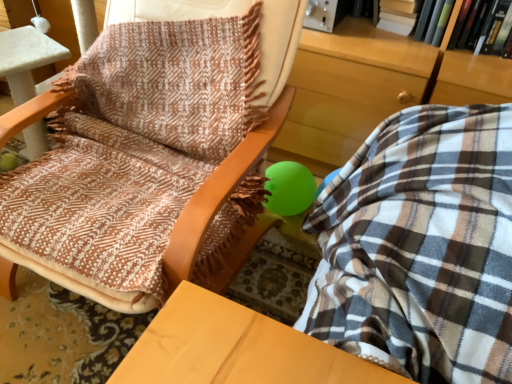
Question: Is white paper book at upper right, which is the 3th book in right-to-left order, closer to camera compared to hardcover book at upper right, which appears as the third book when viewed from the left?

Choices:
 (A) no
 (B) yes

Answer: (A)

Question: Are white paper book at upper right, which is the 3th book in right-to-left order, and hardcover book at upper right, which appears as the third book when viewed from the left, located far from each other?

Choices:
 (A) yes
 (B) no

Answer: (B)

Question: From the image's perspective, does white paper book at upper right, which is the 3th book in right-to-left order, appear lower than hardcover book at upper right, which ranks as the first book in right-to-left order?

Choices:
 (A) no
 (B) yes

Answer: (A)

Question: Can you confirm if white paper book at upper right, which appears as the 1th book when viewed from the left, is smaller than hardcover book at upper right, which ranks as the first book in right-to-left order?

Choices:
 (A) no
 (B) yes

Answer: (A)

Question: Does white paper book at upper right, which is the 3th book in right-to-left order, lie behind hardcover book at upper right, which appears as the third book when viewed from the left?

Choices:
 (A) no
 (B) yes

Answer: (B)

Question: From a real-world perspective, does white paper book at upper right, which appears as the 1th book when viewed from the left, sit lower than hardcover book at upper right, which ranks as the first book in right-to-left order?

Choices:
 (A) no
 (B) yes

Answer: (B)

Question: Considering the relative sizes of brown woven fabric at center and white paper book at upper right, which appears as the 1th book when viewed from the left, in the image provided, is brown woven fabric at center bigger than white paper book at upper right, which appears as the 1th book when viewed from the left,?

Choices:
 (A) yes
 (B) no

Answer: (A)

Question: Is brown woven fabric at center further to the viewer compared to white paper book at upper right, which appears as the 1th book when viewed from the left?

Choices:
 (A) yes
 (B) no

Answer: (B)

Question: Is brown woven fabric at center shorter than white paper book at upper right, which appears as the 1th book when viewed from the left?

Choices:
 (A) yes
 (B) no

Answer: (B)

Question: Can you confirm if brown woven fabric at center is smaller than white paper book at upper right, which appears as the 1th book when viewed from the left?

Choices:
 (A) no
 (B) yes

Answer: (A)

Question: Does brown woven fabric at center have a greater width compared to white paper book at upper right, which is the 3th book in right-to-left order?

Choices:
 (A) yes
 (B) no

Answer: (A)

Question: Considering the relative positions of brown woven fabric at center and white paper book at upper right, which appears as the 1th book when viewed from the left, in the image provided, is brown woven fabric at center to the right of white paper book at upper right, which appears as the 1th book when viewed from the left, from the viewer's perspective?

Choices:
 (A) yes
 (B) no

Answer: (B)

Question: Considering the relative sizes of green matte book at upper right, acting as the 2th book starting from the left, and brown woven fabric at center in the image provided, is green matte book at upper right, acting as the 2th book starting from the left, wider than brown woven fabric at center?

Choices:
 (A) yes
 (B) no

Answer: (B)